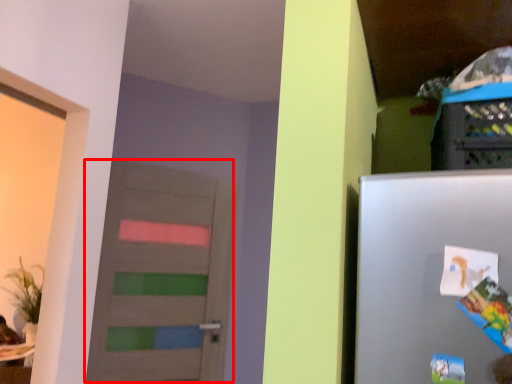
Question: In this image, where is door (annotated by the red box) located relative to comic book?

Choices:
 (A) right
 (B) left

Answer: (B)